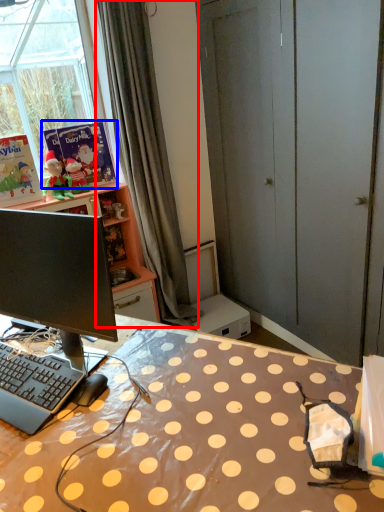
Question: Among these objects, which one is farthest to the camera, curtain (highlighted by a red box) or book (highlighted by a blue box)?

Choices:
 (A) curtain
 (B) book

Answer: (B)